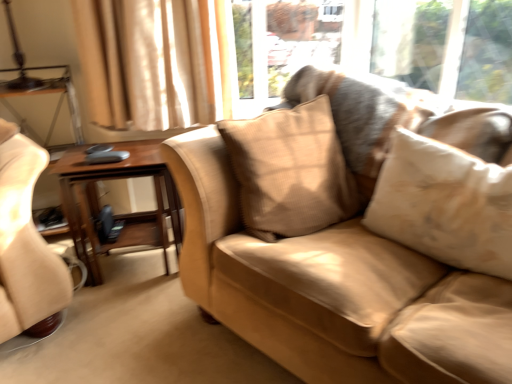
Question: Based on their sizes in the image, would you say suede-like beige couch at center is bigger or smaller than beige textured pillow at center, the 1th pillow from the right?

Choices:
 (A) small
 (B) big

Answer: (B)

Question: Considering the positions of point (202, 258) and point (459, 246), is point (202, 258) closer or farther from the camera than point (459, 246)?

Choices:
 (A) farther
 (B) closer

Answer: (A)

Question: Estimate the real-world distances between objects in this image. Which object is farther from the beige textured pillow at center, the 1th pillow when ordered from left to right?

Choices:
 (A) beige textured pillow at center, the 1th pillow from the right
 (B) woodenmaterial/texturetable at left
 (C) suede-like beige couch at center

Answer: (B)

Question: Considering the real-world distances, which object is farthest from the beige textured pillow at center, the 1th pillow when ordered from left to right?

Choices:
 (A) suede-like beige couch at center
 (B) beige textured pillow at center, the 1th pillow from the right
 (C) woodenmaterial/texturetable at left

Answer: (C)